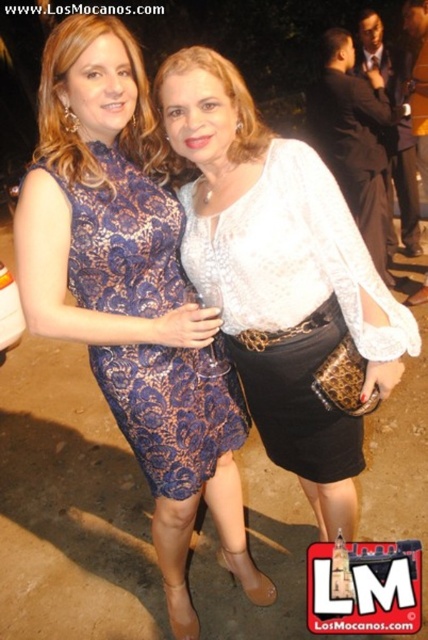
Question: Which of the following is the closest to the observer?

Choices:
 (A) (187, 353)
 (B) (285, 368)

Answer: (B)

Question: Does white lace blouse at center come in front of blue lace dress at center?

Choices:
 (A) yes
 (B) no

Answer: (B)

Question: Does white lace blouse at center appear on the right side of blue lace dress at center?

Choices:
 (A) yes
 (B) no

Answer: (A)

Question: Is white lace blouse at center positioned before blue lace dress at center?

Choices:
 (A) yes
 (B) no

Answer: (B)